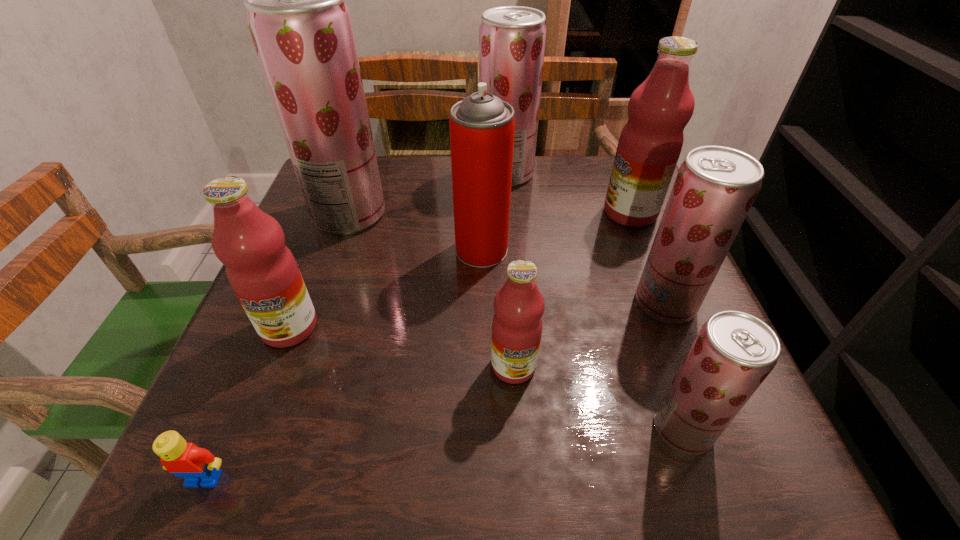
This screenshot has width=960, height=540. I want to click on vacant region located on the left of the third farthest strawberry fruit juice, so click(424, 303).

What are the coordinates of `free region located on the label of the leftmost pink fruit juice` in the screenshot? It's located at (262, 397).

I want to click on free space located on the label of the smallest pink fruit juice, so click(x=521, y=490).

Locate an element on the screen. The height and width of the screenshot is (540, 960). vacant space located 0.050m on the right of the nearest fruit juice is located at coordinates (744, 429).

Where is `fruit juice at the near edge`? fruit juice at the near edge is located at coordinates (733, 353).

Find the location of `Lego that is at the near edge`. Lego that is at the near edge is located at coordinates (198, 466).

The height and width of the screenshot is (540, 960). Identify the location of Lego present at the left edge. (198, 466).

You are a GUI agent. You are given a task and a screenshot of the screen. Output one action in this format:
    pyautogui.click(x=<x>, y=<y>)
    Task: Click on the object that is at the far left corner
    
    Given the screenshot: What is the action you would take?
    pyautogui.click(x=301, y=28)

Find the location of a particular element. object that is at the near left corner is located at coordinates (198, 466).

The height and width of the screenshot is (540, 960). In order to click on object that is positioned at the far right corner in this screenshot , I will do `click(659, 109)`.